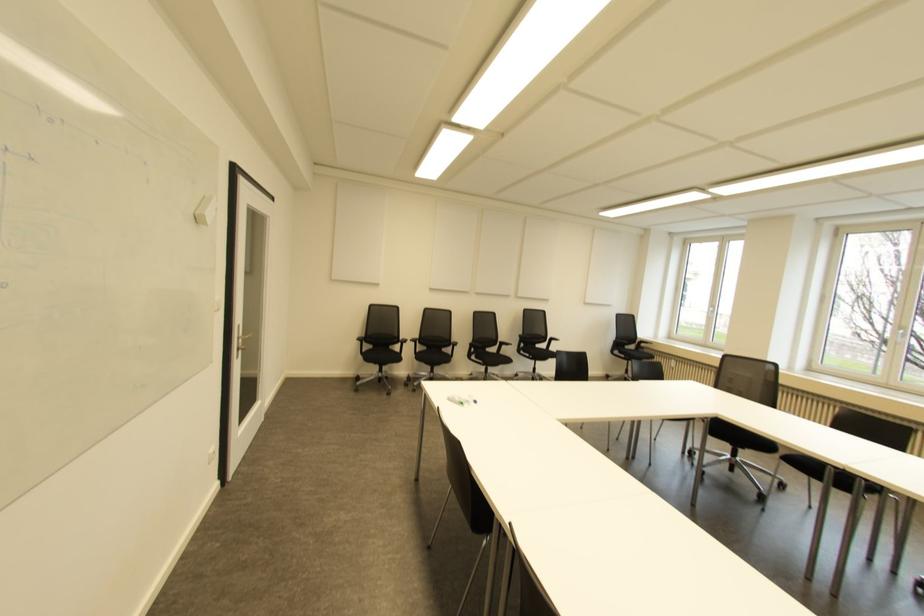
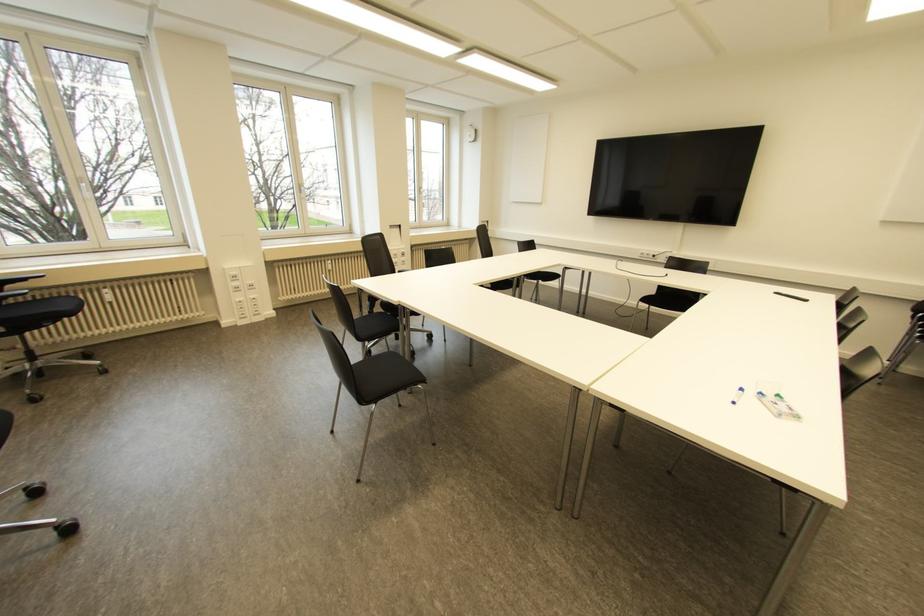
In the second image, find the point that corresponds to point 462,403 in the first image.

(777, 395)